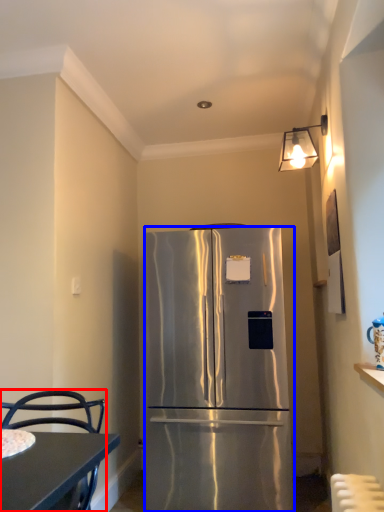
Question: Which point is closer to the camera, chair (highlighted by a red box) or refrigerator (highlighted by a blue box)?

Choices:
 (A) chair
 (B) refrigerator

Answer: (A)